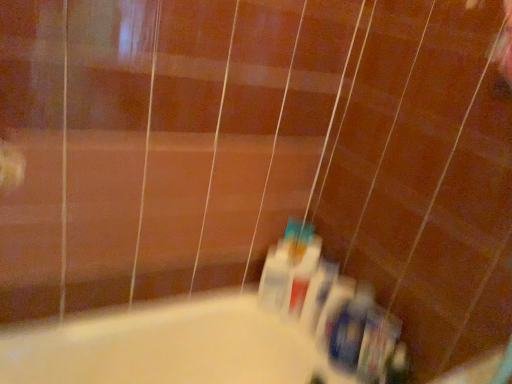
Question: From a real-world perspective, is translucent plastic toothbrush at center, which is the third toiletry in left-to-right order, positioned above or below white plastic mouthwash at lower center?

Choices:
 (A) above
 (B) below

Answer: (B)

Question: Visually, is translucent plastic toothbrush at center, which is the third toiletry in left-to-right order, positioned to the left or to the right of white plastic mouthwash at lower center?

Choices:
 (A) right
 (B) left

Answer: (A)

Question: Considering the real-world distances, which object is closest to the translucent plastic toothbrushes at lower center, positioned as the 2th toiletry in left-to-right order?

Choices:
 (A) white plastic toothpaste tube at center, which ranks as the 5th toiletry in right-to-left order
 (B) translucent plastic toothbrush at center, which is the third toiletry in left-to-right order
 (C) white plastic mouthwash at lower center
 (D) blue plastic toothbrush at lower right, which ranks as the 4th toiletry in left-to-right order
 (E) translucent plastic toothbrush at lower right, the 5th toiletry when ordered from left to right

Answer: (B)

Question: Which object is positioned farthest from the white plastic toothpaste tube at center, which ranks as the 5th toiletry in right-to-left order?

Choices:
 (A) white plastic mouthwash at lower center
 (B) translucent plastic toothbrush at center, positioned as the 3th toiletry in right-to-left order
 (C) translucent plastic toothbrushes at lower center, positioned as the 2th toiletry in left-to-right order
 (D) blue plastic toothbrush at lower right, which ranks as the 2th toiletry in right-to-left order
 (E) translucent plastic toothbrush at lower right, the 5th toiletry when ordered from left to right

Answer: (E)